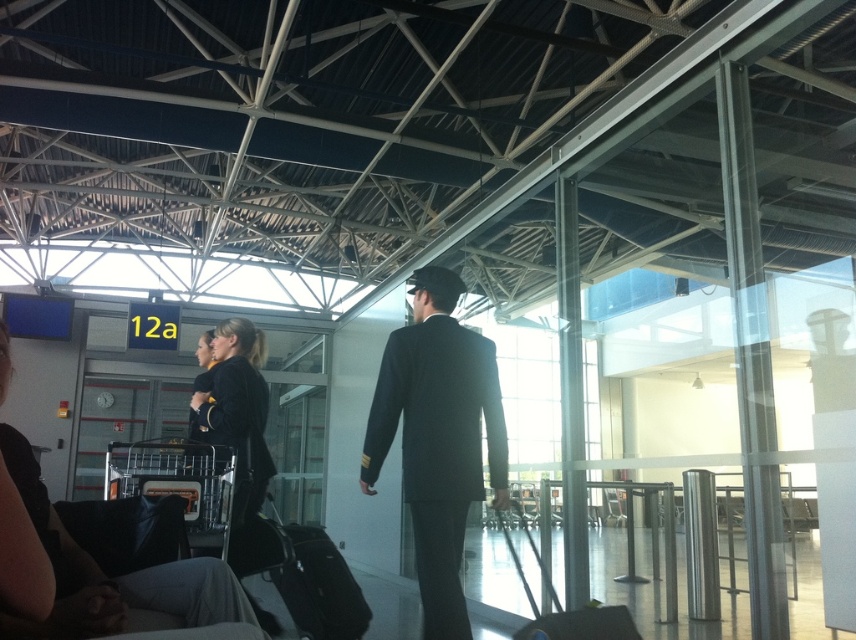
Can you confirm if black leather jacket at upper left is positioned to the left of black velvet jacket at center?

In fact, black leather jacket at upper left is to the right of black velvet jacket at center.

You are a GUI agent. You are given a task and a screenshot of the screen. Output one action in this format:
    pyautogui.click(x=<x>, y=<y>)
    Task: Click on the black leather jacket at upper left
    The image size is (856, 640).
    Given the screenshot: What is the action you would take?
    116,577

Does dark blue suit at center appear under black velvet jacket at center?

Indeed, dark blue suit at center is positioned under black velvet jacket at center.

Does point (444, 401) lie behind point (247, 321)?

No.

I want to click on dark blue suit at center, so click(x=438, y=438).

Which is behind, point (66, 616) or point (542, 618)?

Positioned behind is point (542, 618).

The height and width of the screenshot is (640, 856). I want to click on black leather jacket at upper left, so click(116, 577).